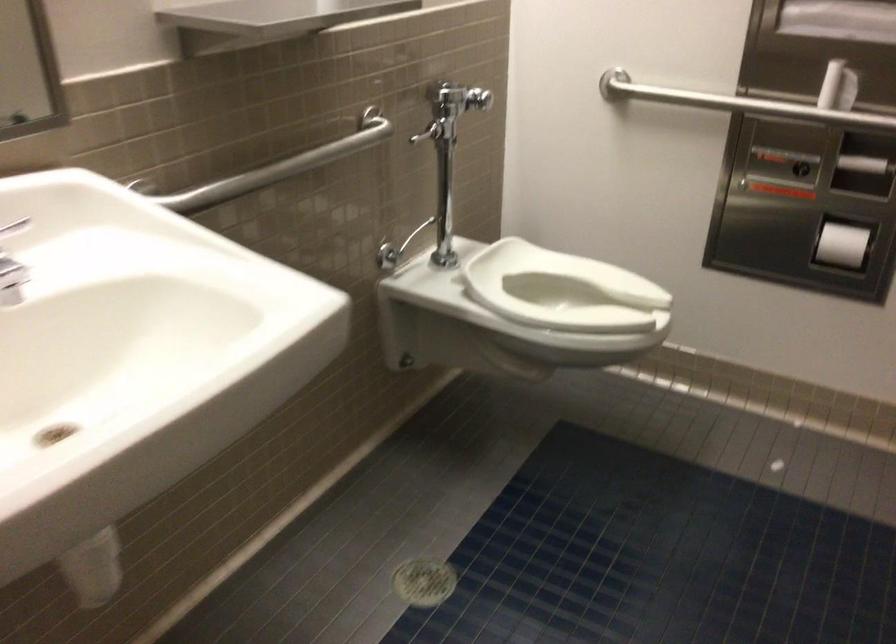
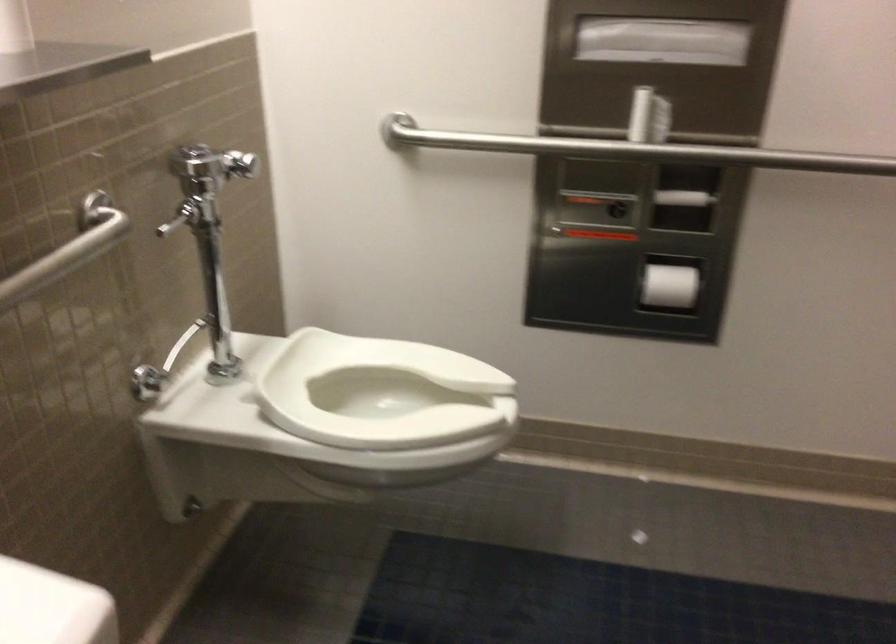
Where in the second image is the point corresponding to [561,299] from the first image?

(381, 393)